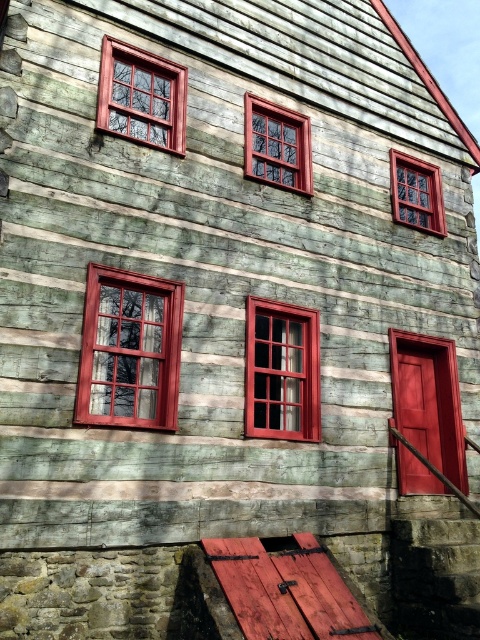
You are standing in front of the rustic wooden building and notice two points marked on its facade. The first point is at coordinates point (144, 384) and the second is at point (405, 224). Which point is positioned closer to your current viewpoint?

Point (144, 384) is closer to the viewer than point (405, 224).

You are an architect assessing the facade of the building. You notice the matte wood window at upper left and the wooden window at center. Which window has a greater width?

The matte wood window at upper left has a greater width than the wooden window at center.

Consider the image. You are standing in front of the rustic wooden building and notice two windows. The first is the matte wood window at center left, and the second is the wooden window at center. Which window is positioned lower on the building?

The matte wood window at center left is located below the wooden window at center, so it is positioned lower on the building.